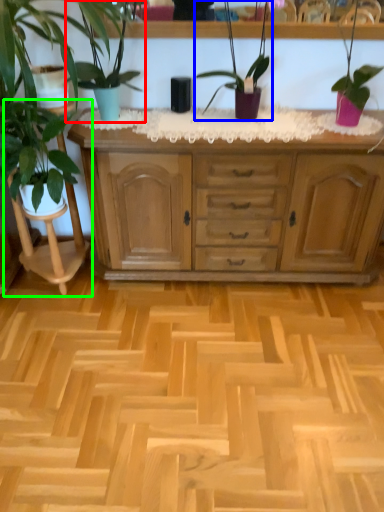
Question: Based on their relative distances, which object is farther from houseplant (highlighted by a red box)? Choose from houseplant (highlighted by a blue box) and rocking chair (highlighted by a green box).

Choices:
 (A) houseplant
 (B) rocking chair

Answer: (B)